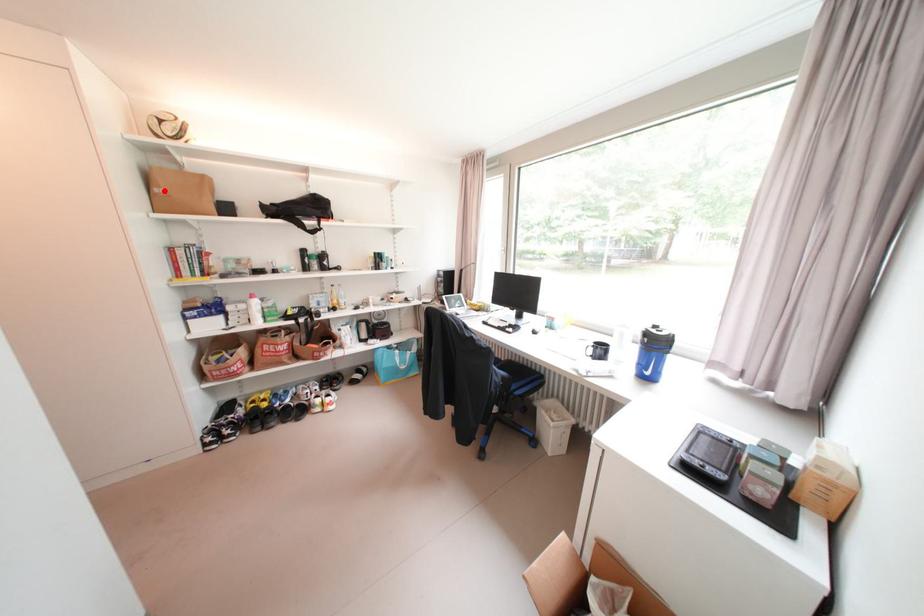
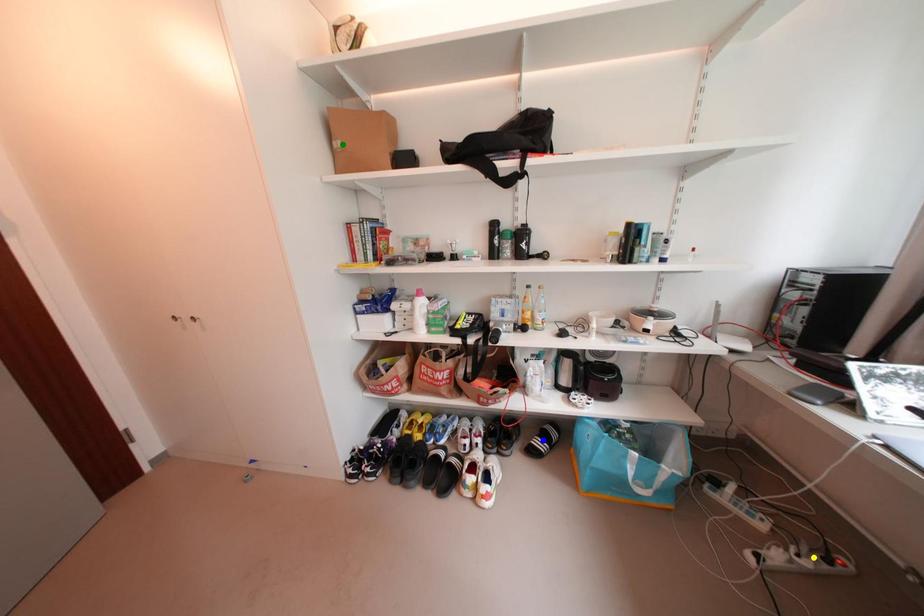
Question: I am providing you with two images of the same scene from different viewpoints. A red point is marked on the first image. You are given multiple points on the second image. Which point in image 2 is actually the same real-world point as the red point in image 1?

Choices:
 (A) blue point
 (B) green point
 (C) yellow point

Answer: (B)